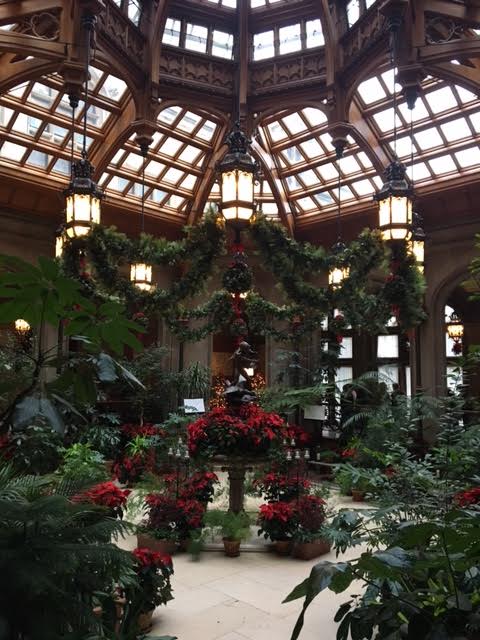
The height and width of the screenshot is (640, 480). I want to click on row of windows on right center side, so click(x=387, y=347), click(x=344, y=347), click(x=451, y=349).